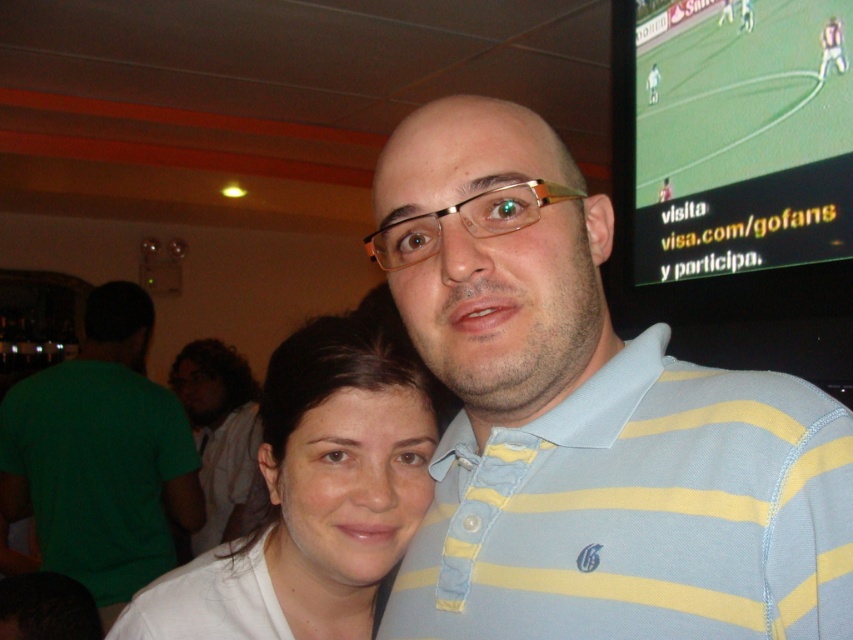
You are taking a photo of two people standing side by side. You need to know which person is wearing the light blue striped polo shirt at center and which is wearing the white fabric shirt at center. Based on their positions, can you determine which is on the right?

The light blue striped polo shirt at center is positioned on the right side of the white fabric shirt at center, so the person wearing the light blue striped polo shirt at center is on the right, and the one in the white fabric shirt at center is on the left.

You are a photographer trying to capture a group photo of two people standing at the point (425, 173). The minimum recommended distance between subjects for clear facial features is 24 inches. Based on the scene description, will the two people be positioned far enough apart to meet this requirement?

The two people are 24.55 inches apart, which exceeds the minimum recommended distance of 24 inches. Therefore, they are positioned far enough apart for clear facial features in the photo.